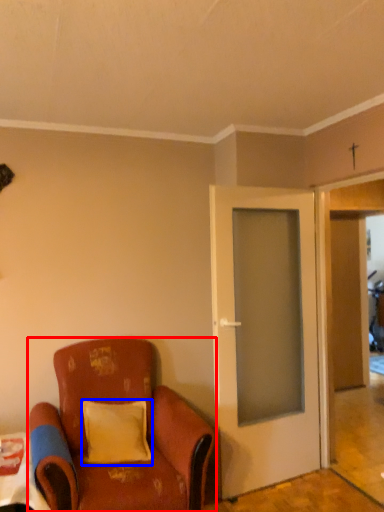
Question: Which object appears closest to the camera in this image, chair (highlighted by a red box) or pillow (highlighted by a blue box)?

Choices:
 (A) chair
 (B) pillow

Answer: (A)